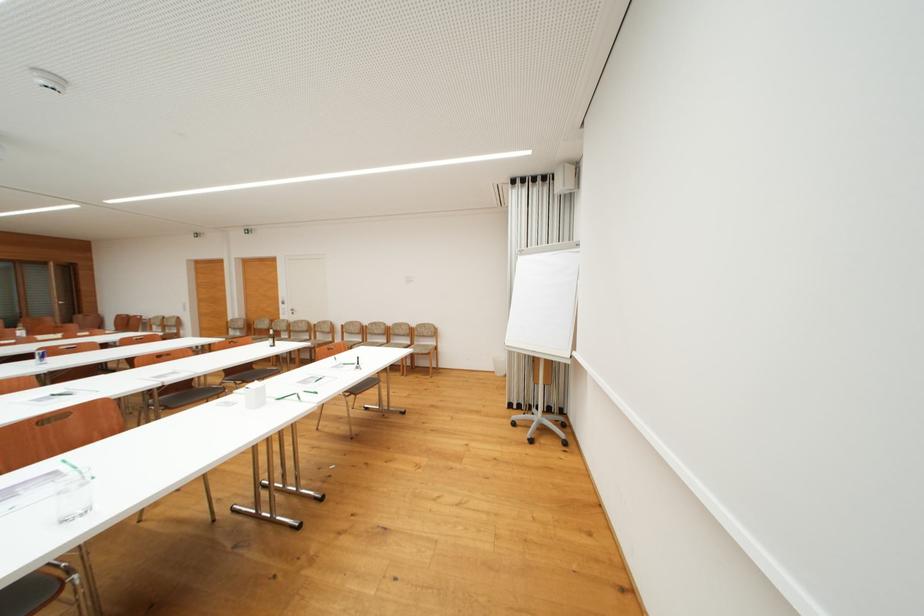
Where would you push the mobile whiteboard? Please return your answer as a coordinate pair (x, y).

(543, 302)